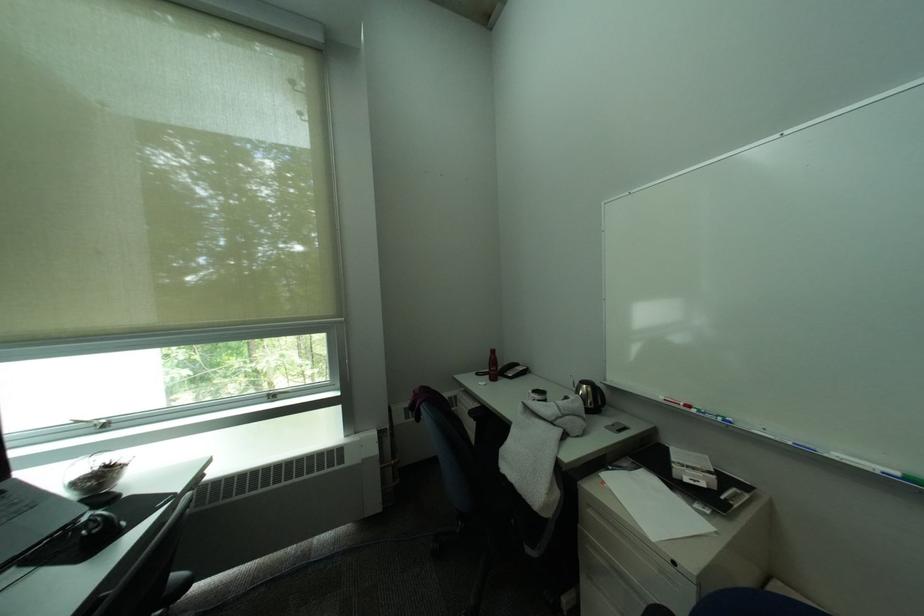
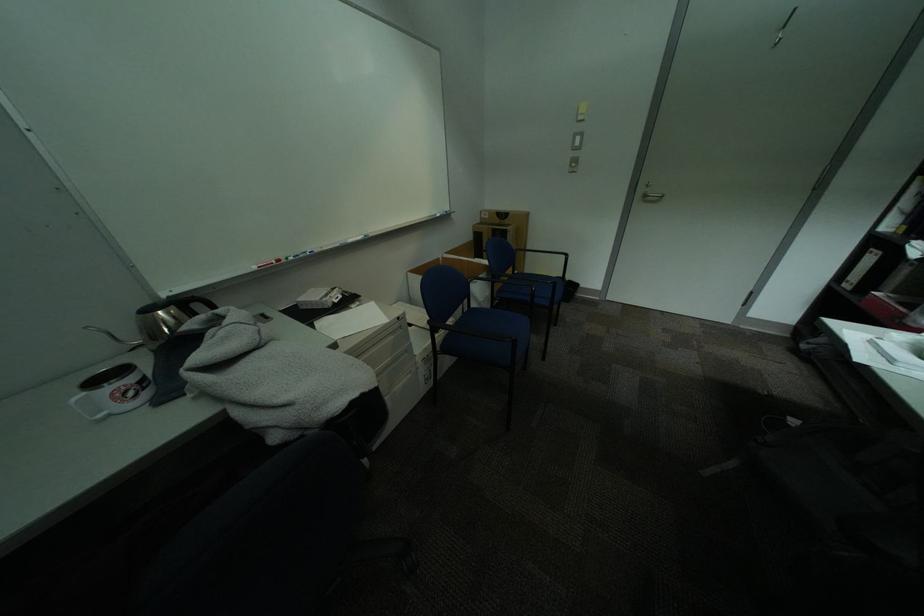
In the second image, find the point that corresponds to (611,389) in the first image.

(204, 297)